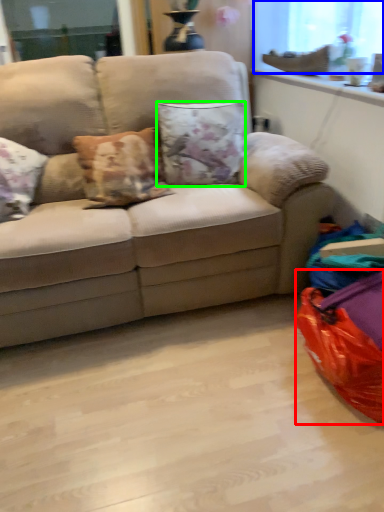
Question: Estimate the real-world distances between objects in this image. Which object is closer to bean bag chair (highlighted by a red box), window screen (highlighted by a blue box) or pillow (highlighted by a green box)?

Choices:
 (A) window screen
 (B) pillow

Answer: (B)